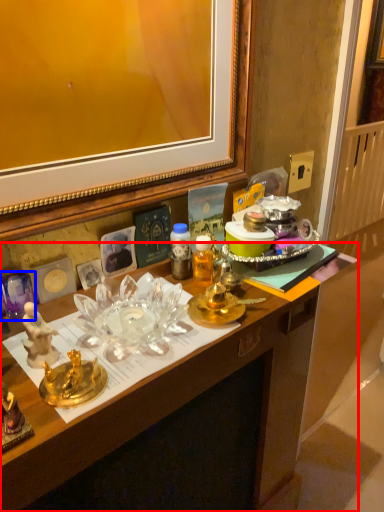
Question: Which of the following is the closest to the observer, desk (highlighted by a red box) or plate (highlighted by a blue box)?

Choices:
 (A) desk
 (B) plate

Answer: (A)